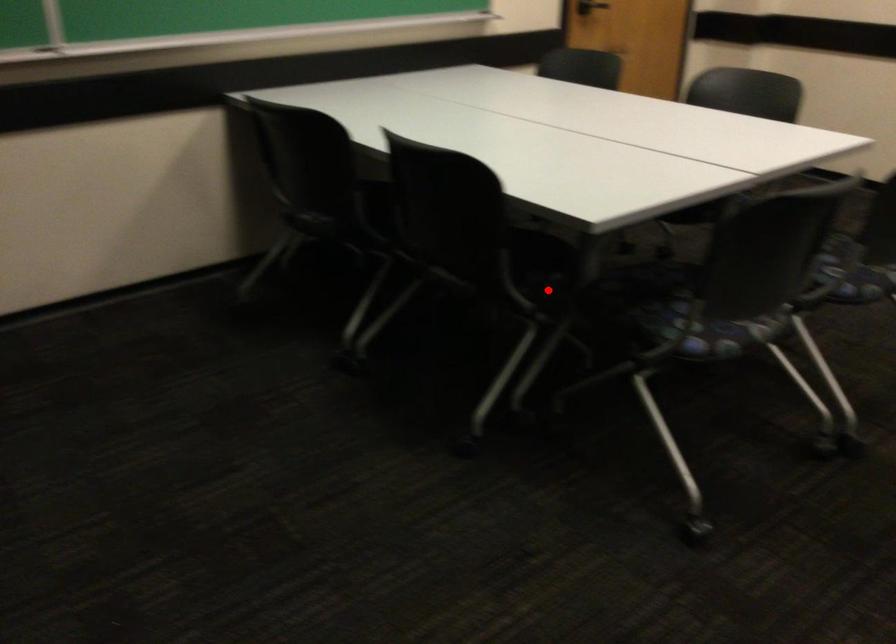
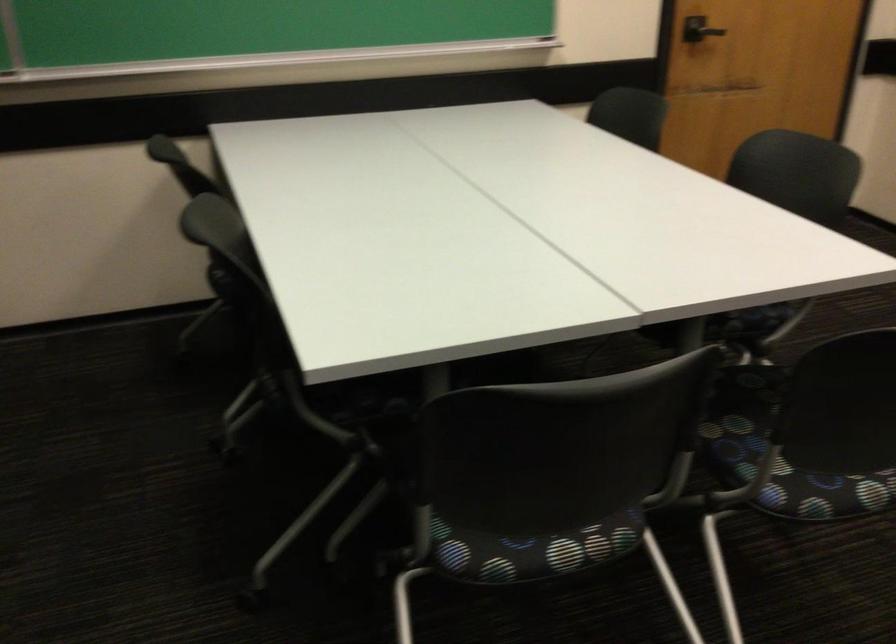
Question: I am providing you with two images of the same scene from different viewpoints. Image1 has a red point marked. In image2, the corresponding 3D location appears at what relative position? Reply with the corresponding letter.

Choices:
 (A) Closer
 (B) Farther

Answer: (A)